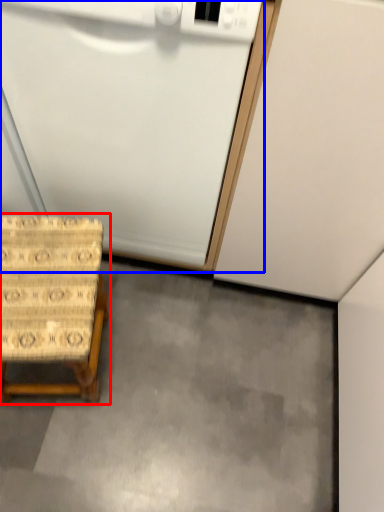
Question: Among these objects, which one is nearest to the camera, furniture (highlighted by a red box) or appliance (highlighted by a blue box)?

Choices:
 (A) furniture
 (B) appliance

Answer: (B)